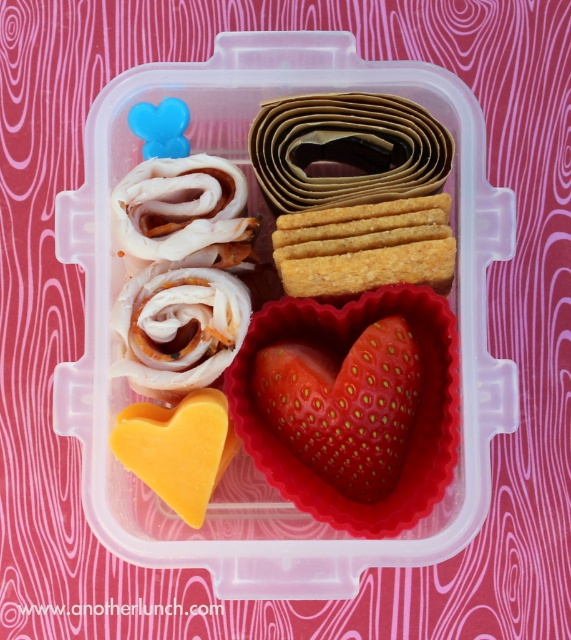
Consider the image. You are a food delivery person who needs to ensure the red matte strawberry at center and the golden crisp crackers at center are visible to the customer. Based on the scene, is the strawberry visible through the transparent plastic lid?

The red matte strawberry at center is positioned under golden crisp crackers at center, so it might be partially or fully obscured by the crackers, making it less visible through the transparent plastic lid.

You are a food delivery person who needs to deliver this lunchbox to a customer. The customer mentioned they have an allergy to strawberries. Looking at the image, can you confirm if there is a red matte strawberry at center in the lunchbox?

Yes, there is a red matte strawberry at center located at point coordinates of (343,404) in the lunchbox.

You are packing a lunchbox and want to place the red matte strawberry at center and golden crisp crackers at center closer together. According to the image, how far apart are they?

The red matte strawberry at center is 4.98 inches from golden crisp crackers at center, so they are nearly 5 inches apart.